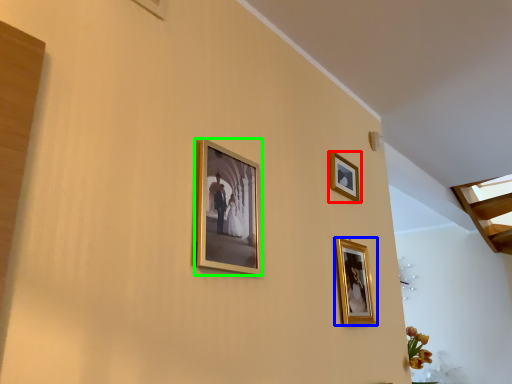
Question: Which object is the closest to the picture frame (highlighted by a red box)? Choose among these: picture frame (highlighted by a blue box) or picture frame (highlighted by a green box).

Choices:
 (A) picture frame
 (B) picture frame

Answer: (A)